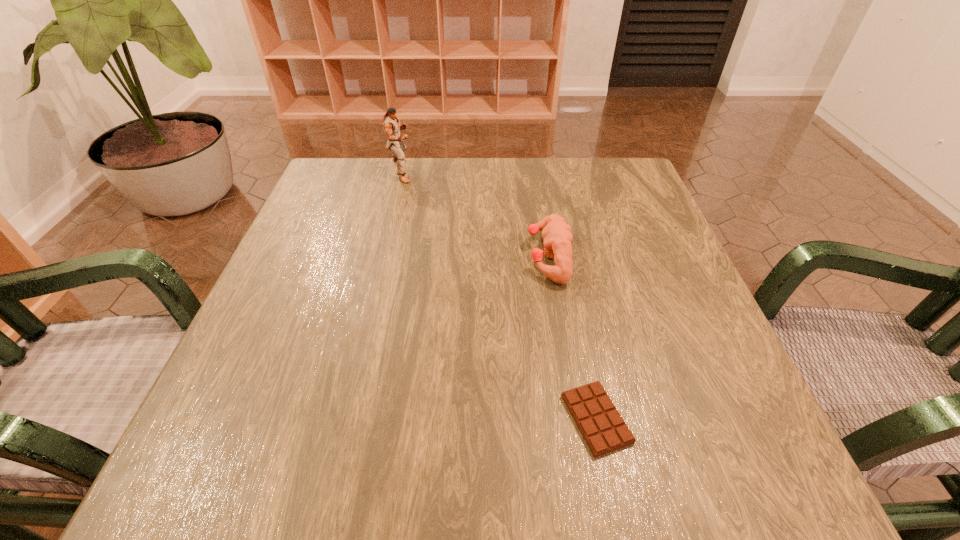
At what (x,y) coordinates should I click in order to perform the action: click on free space located on the left of the candy bar. Please return your answer as a coordinate pair (x, y). The width and height of the screenshot is (960, 540). Looking at the image, I should click on (365, 419).

Locate an element on the screen. object present at the far edge is located at coordinates (391, 125).

Locate an element on the screen. The width and height of the screenshot is (960, 540). object that is at the near edge is located at coordinates (604, 430).

Where is `free space at the far edge`? This screenshot has height=540, width=960. free space at the far edge is located at coordinates (456, 170).

At what (x,y) coordinates should I click in order to perform the action: click on free space at the near edge. Please return your answer as a coordinate pair (x, y). Looking at the image, I should click on (647, 435).

I want to click on vacant space at the left edge, so click(273, 328).

Image resolution: width=960 pixels, height=540 pixels. I want to click on vacant space at the right edge of the desktop, so click(621, 229).

This screenshot has width=960, height=540. I want to click on free space at the far right corner of the desktop, so click(601, 170).

This screenshot has height=540, width=960. Find the location of `vacant space at the near right corner of the desktop`. vacant space at the near right corner of the desktop is located at coordinates (694, 447).

Identify the location of empty location between the farthest object and the shortest object. (499, 295).